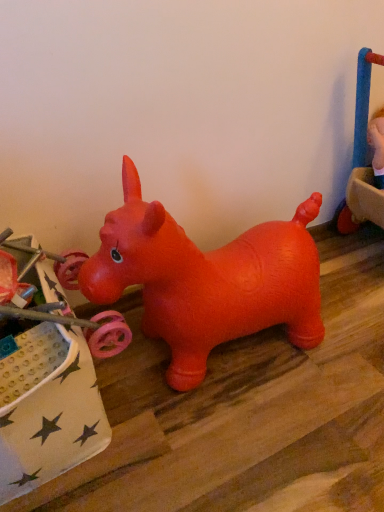
The height and width of the screenshot is (512, 384). What do you see at coordinates (363, 103) in the screenshot?
I see `rubber dog at upper right, which is the second toy in bottom-to-top order` at bounding box center [363, 103].

In order to face rubber dog at upper right, acting as the 2th toy starting from the front, should I rotate leftwards or rightwards?

It's best to rotate right around 24.371 degrees.

Identify the location of rubber dog at upper right, which is the second toy in bottom-to-top order. (363, 103).

What is the approximate width of rubber dog at upper right, acting as the 2th toy starting from the front?

The width of rubber dog at upper right, acting as the 2th toy starting from the front, is 17.67 centimeters.

Measure the distance between point (x=355, y=117) and camera.

3.67 feet.

Locate an element on the screen. The height and width of the screenshot is (512, 384). rubber dog at center, the second toy when ordered from top to bottom is located at coordinates (48, 408).

This screenshot has height=512, width=384. Describe the element at coordinates (48, 408) in the screenshot. I see `rubber dog at center, the second toy viewed from the right` at that location.

Locate an element on the screen. rubber dog at upper right, positioned as the second toy in left-to-right order is located at coordinates (363, 103).

Can you confirm if rubber dog at upper right, which is counted as the 1th toy, starting from the back, is positioned to the left of rubber dog at center, which is counted as the 1th toy, starting from the front?

No, rubber dog at upper right, which is counted as the 1th toy, starting from the back, is not to the left of rubber dog at center, which is counted as the 1th toy, starting from the front.

Is rubber dog at upper right, acting as the 1th toy starting from the top, in front of or behind rubber dog at center, acting as the first toy starting from the bottom, in the image?

Clearly, rubber dog at upper right, acting as the 1th toy starting from the top, is behind rubber dog at center, acting as the first toy starting from the bottom.

Which point is more distant from viewer, [368,52] or [47,390]?

The point [368,52] is farther.

In the scene shown: From the image's perspective, would you say rubber dog at upper right, which is the second toy in bottom-to-top order, is shown under rubber dog at center, marked as the 2th toy in a back-to-front arrangement?

Incorrect, from the image's perspective, rubber dog at upper right, which is the second toy in bottom-to-top order, is higher than rubber dog at center, marked as the 2th toy in a back-to-front arrangement.

From a real-world perspective, relative to rubber dog at center, the second toy when ordered from top to bottom, is rubber dog at upper right, which is the second toy in bottom-to-top order, vertically above or below?

rubber dog at upper right, which is the second toy in bottom-to-top order, is situated higher than rubber dog at center, the second toy when ordered from top to bottom, in the real world.

Which of these two, rubber dog at upper right, which is counted as the 1th toy, starting from the back, or rubber dog at center, the second toy when ordered from top to bottom, is thinner?

rubber dog at upper right, which is counted as the 1th toy, starting from the back.

Considering the sizes of objects rubber dog at upper right, acting as the 1th toy starting from the top, and rubber dog at center, the 1th toy in the left-to-right sequence, in the image provided, who is shorter, rubber dog at upper right, acting as the 1th toy starting from the top, or rubber dog at center, the 1th toy in the left-to-right sequence,?

rubber dog at upper right, acting as the 1th toy starting from the top.

Considering the sizes of objects rubber dog at upper right, which appears as the 1th toy when viewed from the right, and rubber dog at center, which is counted as the 1th toy, starting from the front, in the image provided, who is smaller, rubber dog at upper right, which appears as the 1th toy when viewed from the right, or rubber dog at center, which is counted as the 1th toy, starting from the front,?

rubber dog at upper right, which appears as the 1th toy when viewed from the right.

Is rubber dog at center, the second toy when ordered from top to bottom, located within rubber dog at upper right, acting as the 2th toy starting from the front?

No, rubber dog at center, the second toy when ordered from top to bottom, is located outside of rubber dog at upper right, acting as the 2th toy starting from the front.

Based on the photo, is rubber dog at upper right, which appears as the 1th toy when viewed from the right, positioned far away from rubber dog at center, marked as the 2th toy in a back-to-front arrangement?

No.

Is rubber dog at upper right, acting as the 1th toy starting from the top, turned away from rubber dog at center, which is counted as the 1th toy, starting from the front?

rubber dog at upper right, acting as the 1th toy starting from the top, does not have its back to rubber dog at center, which is counted as the 1th toy, starting from the front.

How much distance is there between rubber dog at upper right, acting as the 2th toy starting from the front, and rubber dog at center, the 1th toy in the left-to-right sequence?

37.52 inches.

There is a rubber dog at center, acting as the first toy starting from the bottom. Identify the location of toy above it (from a real-world perspective). This screenshot has height=512, width=384. (363, 103).

Does rubber dog at center, acting as the first toy starting from the bottom, appear on the right side of rubber dog at upper right, which appears as the 1th toy when viewed from the right?

In fact, rubber dog at center, acting as the first toy starting from the bottom, is to the left of rubber dog at upper right, which appears as the 1th toy when viewed from the right.

Considering the positions of objects rubber dog at center, the second toy when ordered from top to bottom, and rubber dog at upper right, which appears as the 1th toy when viewed from the right, in the image provided, who is in front, rubber dog at center, the second toy when ordered from top to bottom, or rubber dog at upper right, which appears as the 1th toy when viewed from the right,?

rubber dog at center, the second toy when ordered from top to bottom, is closer to the camera.

Does point (19, 496) appear closer or farther from the camera than point (361, 60)?

Point (19, 496) is closer to the camera than point (361, 60).

From the image's perspective, which is below, rubber dog at center, the second toy when ordered from top to bottom, or rubber dog at upper right, which is the second toy in bottom-to-top order?

rubber dog at center, the second toy when ordered from top to bottom, is shown below in the image.

From a real-world perspective, which object stands above the other?

rubber dog at upper right, acting as the 1th toy starting from the top, is physically above.

Which of these two, rubber dog at center, marked as the 2th toy in a back-to-front arrangement, or rubber dog at upper right, which is counted as the 1th toy, starting from the back, is wider?

rubber dog at center, marked as the 2th toy in a back-to-front arrangement.

Can you confirm if rubber dog at center, the second toy viewed from the right, is shorter than rubber dog at upper right, positioned as the second toy in left-to-right order?

In fact, rubber dog at center, the second toy viewed from the right, may be taller than rubber dog at upper right, positioned as the second toy in left-to-right order.

Considering the sizes of objects rubber dog at center, the second toy viewed from the right, and rubber dog at upper right, acting as the 1th toy starting from the top, in the image provided, who is bigger, rubber dog at center, the second toy viewed from the right, or rubber dog at upper right, acting as the 1th toy starting from the top,?

With larger size is rubber dog at center, the second toy viewed from the right.

Is rubber dog at upper right, which appears as the 1th toy when viewed from the right, inside rubber dog at center, the second toy viewed from the right?

No, rubber dog at upper right, which appears as the 1th toy when viewed from the right, is not a part of rubber dog at center, the second toy viewed from the right.

Is rubber dog at center, the second toy viewed from the right, not close to rubber dog at upper right, positioned as the second toy in left-to-right order?

No, rubber dog at center, the second toy viewed from the right, is not far away from rubber dog at upper right, positioned as the second toy in left-to-right order.

Is rubber dog at center, the second toy when ordered from top to bottom, turned away from rubber dog at upper right, acting as the 1th toy starting from the top?

No, rubber dog at upper right, acting as the 1th toy starting from the top, is not at the back of rubber dog at center, the second toy when ordered from top to bottom.

Measure the distance from rubber dog at center, which is counted as the 1th toy, starting from the front, to rubber dog at upper right, positioned as the second toy in left-to-right order.

rubber dog at center, which is counted as the 1th toy, starting from the front, is 95.31 centimeters away from rubber dog at upper right, positioned as the second toy in left-to-right order.

Identify the location of toy above the rubber dog at center, which is counted as the 1th toy, starting from the front (from the image's perspective). (363, 103).

At what (x,y) coordinates should I click in order to perform the action: click on toy below the rubber dog at upper right, acting as the 2th toy starting from the front (from a real-world perspective). Please return your answer as a coordinate pair (x, y). The width and height of the screenshot is (384, 512). Looking at the image, I should click on (48, 408).

This screenshot has width=384, height=512. Find the location of `toy on the left of rubber dog at upper right, which appears as the 1th toy when viewed from the right`. toy on the left of rubber dog at upper right, which appears as the 1th toy when viewed from the right is located at coordinates (48, 408).